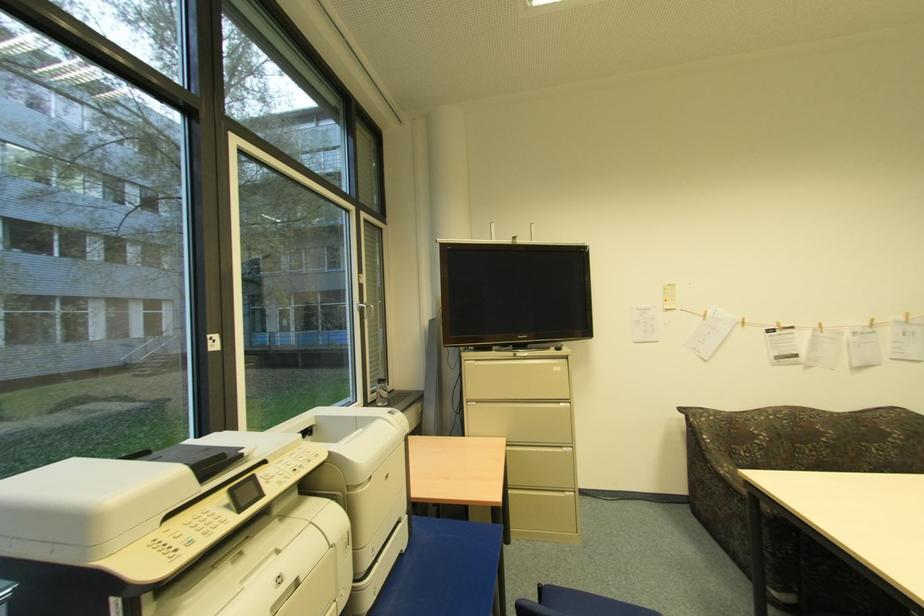
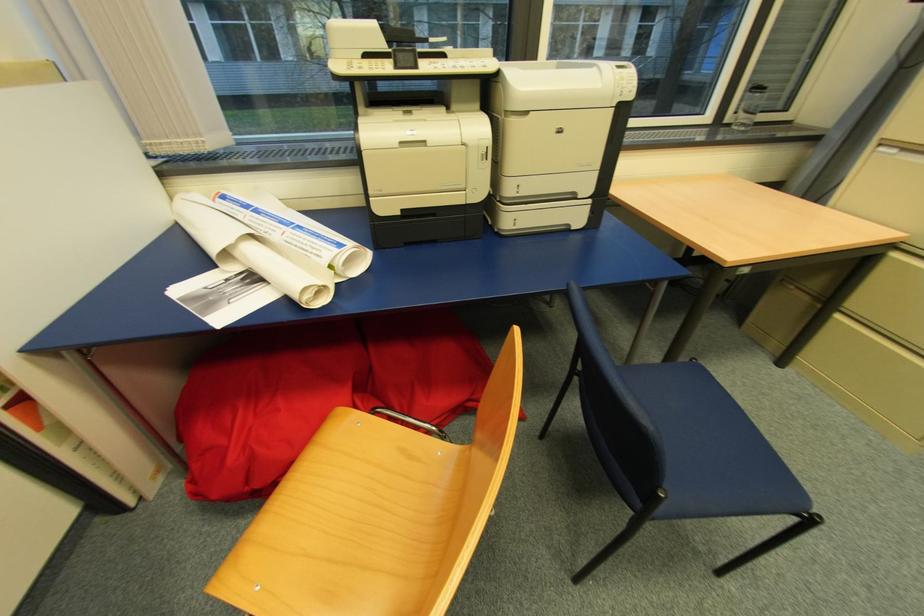
Where in the second image is the point corresponding to point (511, 487) from the first image?

(845, 310)